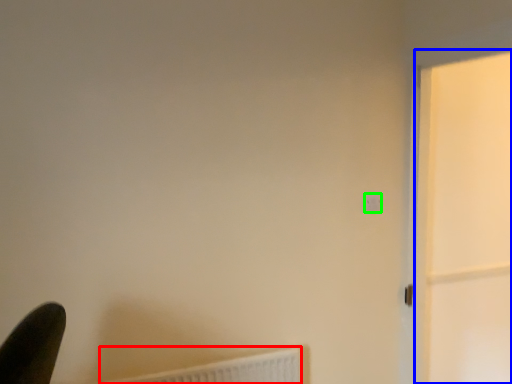
Question: Which object is positioned closest to radiator (highlighted by a red box)? Select from screen door (highlighted by a blue box) and light switch (highlighted by a green box).

Choices:
 (A) screen door
 (B) light switch

Answer: (B)